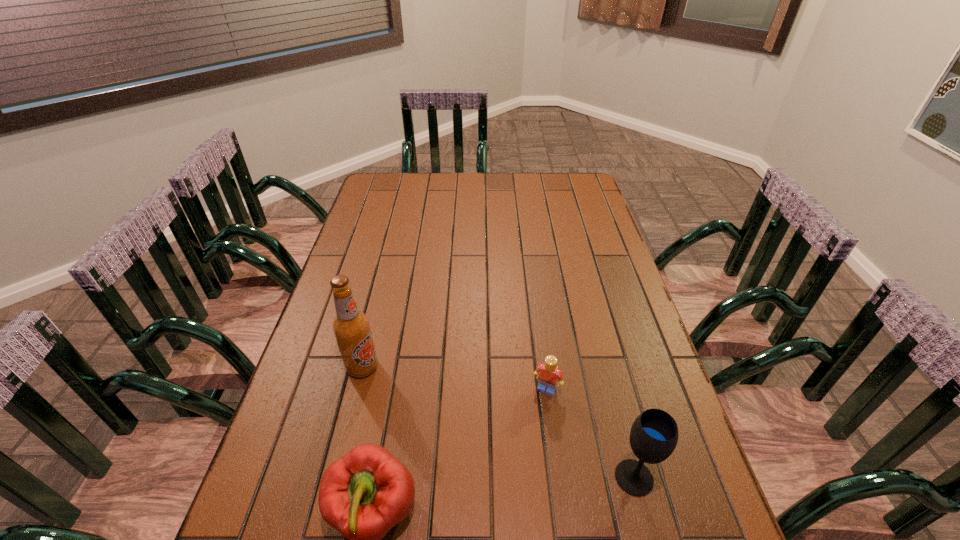
At what (x,y) coordinates should I click in order to perform the action: click on vacant space on the desktop that is between the bell pepper and the third shortest object and is positioned on the front-facing side of the second object from right to left. Please return your answer as a coordinate pair (x, y). The height and width of the screenshot is (540, 960). Looking at the image, I should click on point(499,496).

Find the location of a particular element. vacant space on the desktop that is between the bell pepper and the second tallest object and is positioned on the front label of the beer bottle is located at coordinates (522, 493).